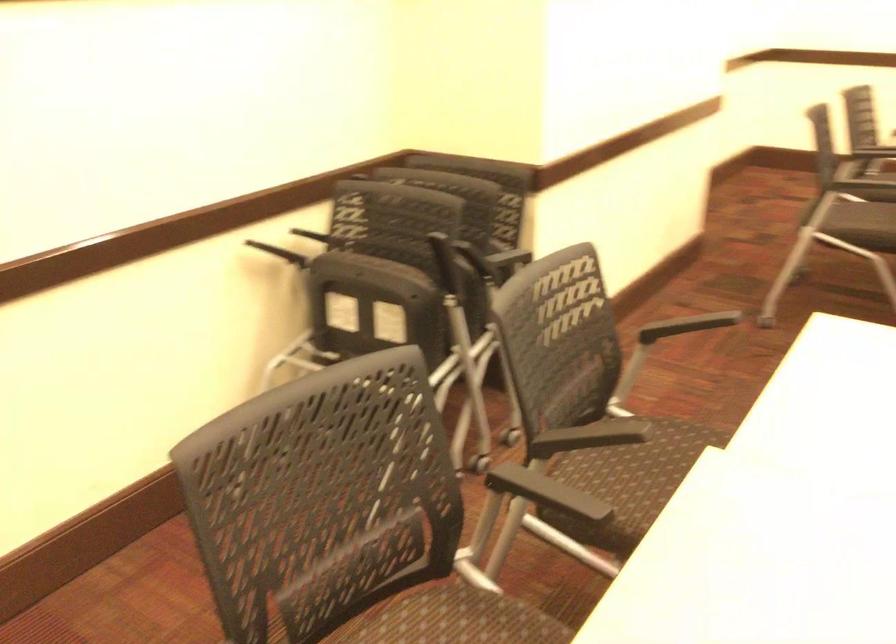
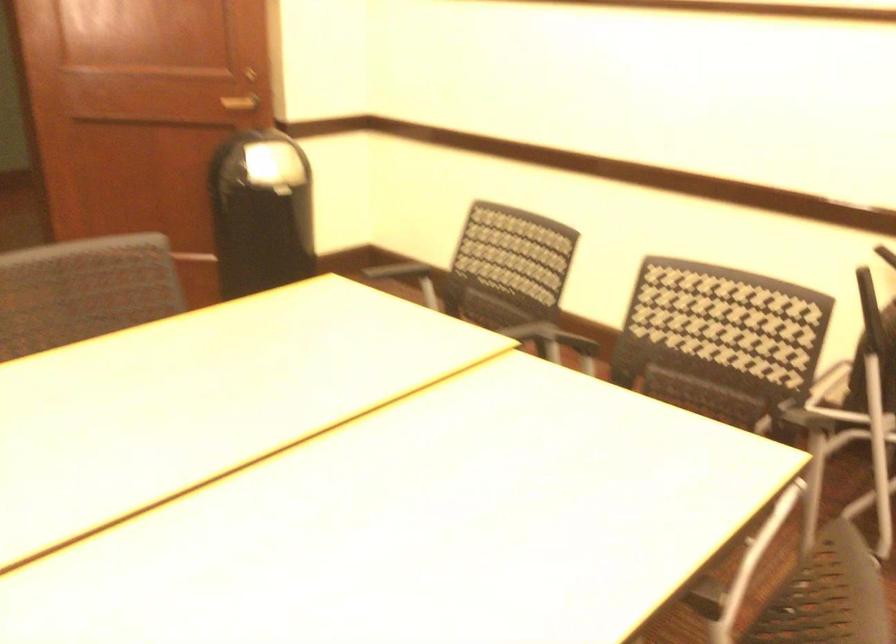
The point at (552, 438) is marked in the first image. Where is the corresponding point in the second image?

(652, 398)